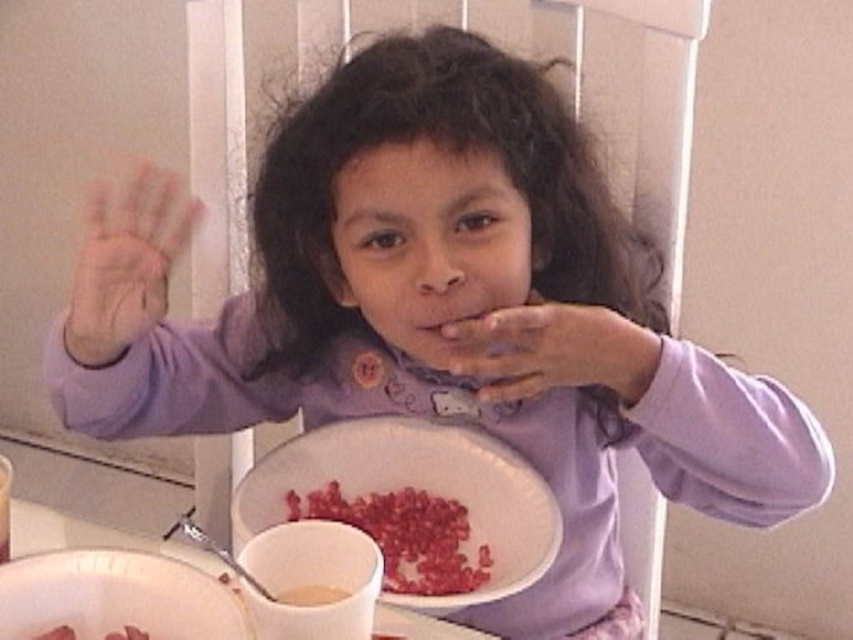
The child is sitting at the table with a smooth red cereal at center and a white glossy mug at lower center. Which object is positioned higher on the table?

The smooth red cereal at center is located above the white glossy mug at lower center, so it is positioned higher on the table.